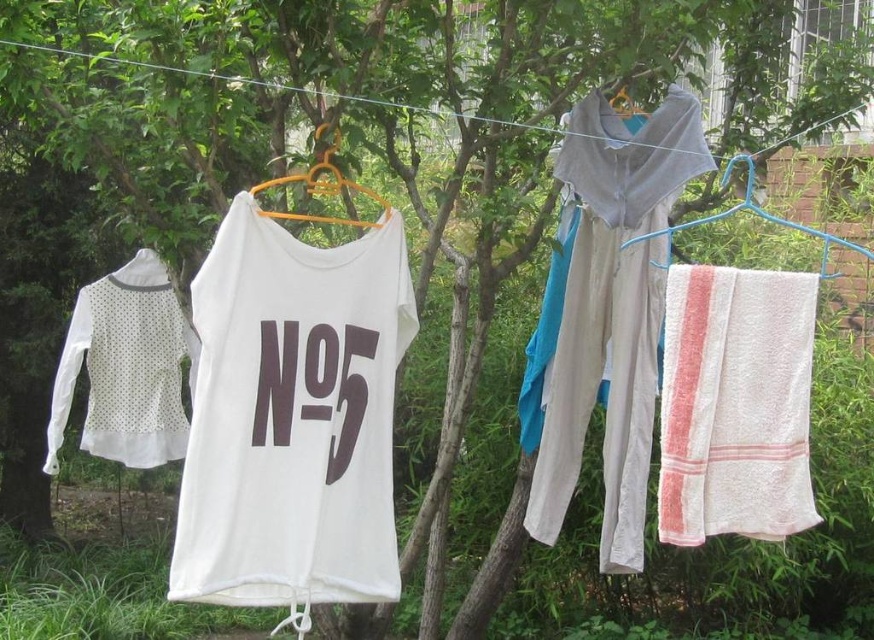
Question: Does white cotton t-shirt at center appear under orange plastic hanger at center?

Choices:
 (A) yes
 (B) no

Answer: (A)

Question: Among these points, which one is farthest from the camera?

Choices:
 (A) click(x=168, y=330)
 (B) click(x=626, y=113)
 (C) click(x=757, y=451)

Answer: (A)

Question: Which of these objects is positioned farthest from the white cotton shirt at upper center?

Choices:
 (A) orange plastic hanger at center
 (B) white cotton t-shirt at center

Answer: (B)

Question: Which of the following is the closest to the observer?

Choices:
 (A) (674, 364)
 (B) (313, 179)
 (C) (625, 90)

Answer: (B)

Question: Where is white textured towel at right located in relation to white cotton shirt at upper center in the image?

Choices:
 (A) left
 (B) right

Answer: (B)

Question: Is white cotton t-shirt at center smaller than white textured towel at right?

Choices:
 (A) yes
 (B) no

Answer: (B)